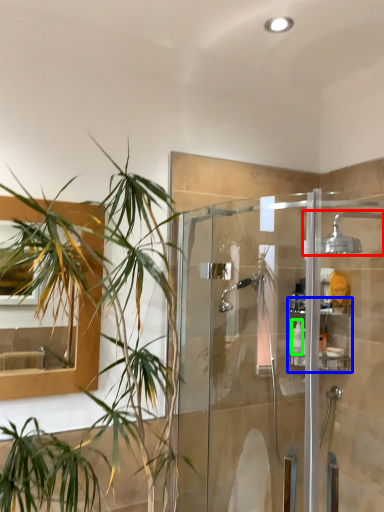
Question: Which is farther away from shower (highlighted by a red box)? shelf (highlighted by a blue box) or toiletry (highlighted by a green box)?

Choices:
 (A) shelf
 (B) toiletry

Answer: (B)